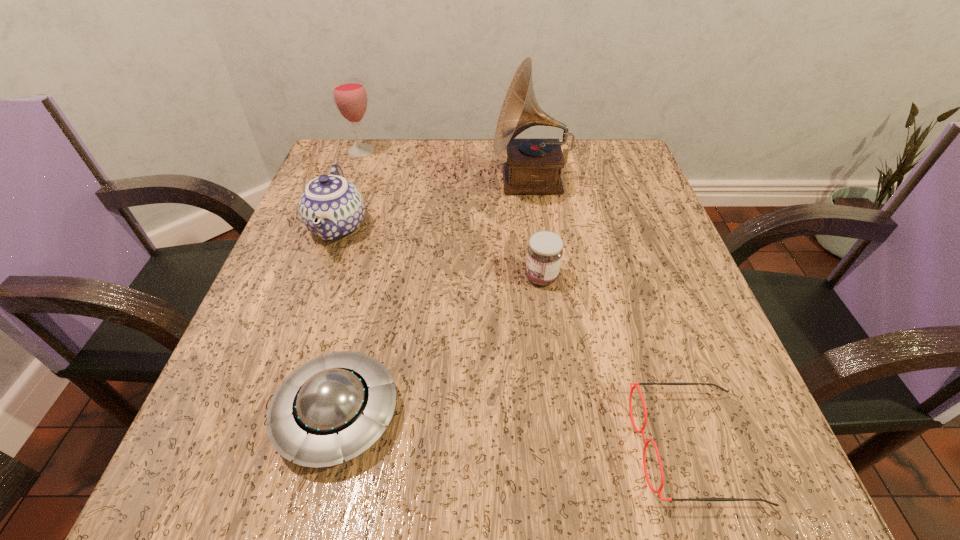
The image size is (960, 540). Find the location of `wineglass at the far edge`. wineglass at the far edge is located at coordinates (350, 97).

Image resolution: width=960 pixels, height=540 pixels. I want to click on saucer positioned at the near edge, so click(x=334, y=407).

This screenshot has width=960, height=540. In order to click on spectacles at the near edge in this screenshot , I will do `click(646, 445)`.

Find the location of a particular element. The width and height of the screenshot is (960, 540). wineglass present at the left edge is located at coordinates (350, 97).

Image resolution: width=960 pixels, height=540 pixels. I want to click on chinaware located at the left edge, so click(331, 207).

The height and width of the screenshot is (540, 960). Find the location of `saucer that is at the left edge`. saucer that is at the left edge is located at coordinates (334, 407).

The height and width of the screenshot is (540, 960). What are the coordinates of `object located in the right edge section of the desktop` in the screenshot? It's located at (646, 445).

At what (x,y) coordinates should I click in order to perform the action: click on object present at the far left corner. Please return your answer as a coordinate pair (x, y). Looking at the image, I should click on point(350,97).

You are a GUI agent. You are given a task and a screenshot of the screen. Output one action in this format:
    pyautogui.click(x=<x>, y=<y>)
    Task: Click on the object at the near left corner
    This screenshot has width=960, height=540.
    Given the screenshot: What is the action you would take?
    pyautogui.click(x=334, y=407)

Where is `object positioned at the near right corner`? The height and width of the screenshot is (540, 960). object positioned at the near right corner is located at coordinates click(x=646, y=445).